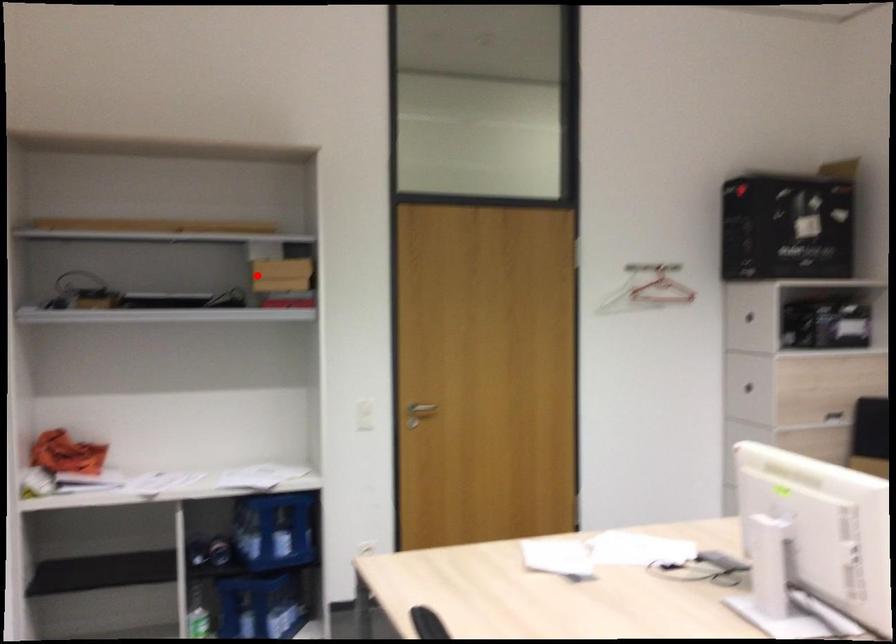
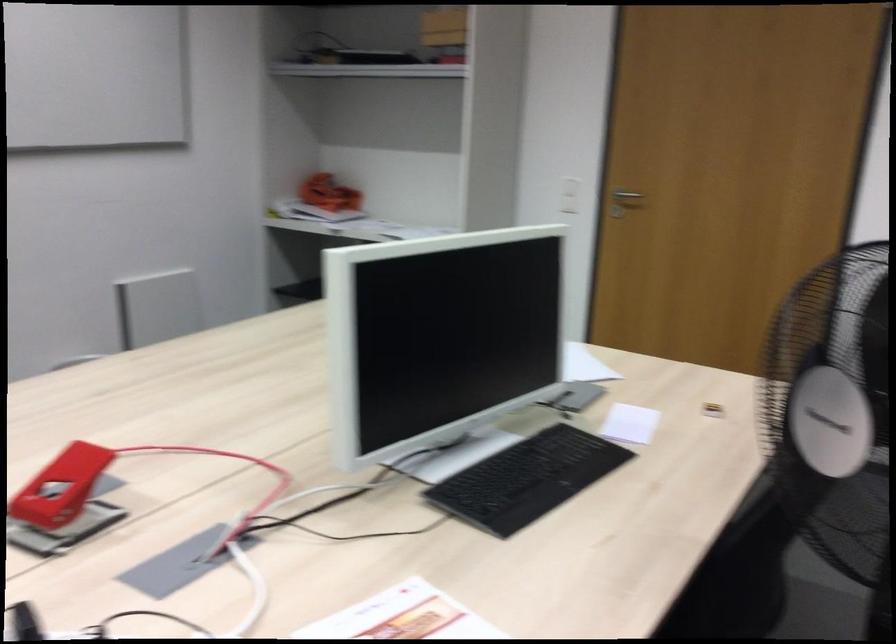
The point at the highlighted location is marked in the first image. Where is the corresponding point in the second image?

(444, 26)